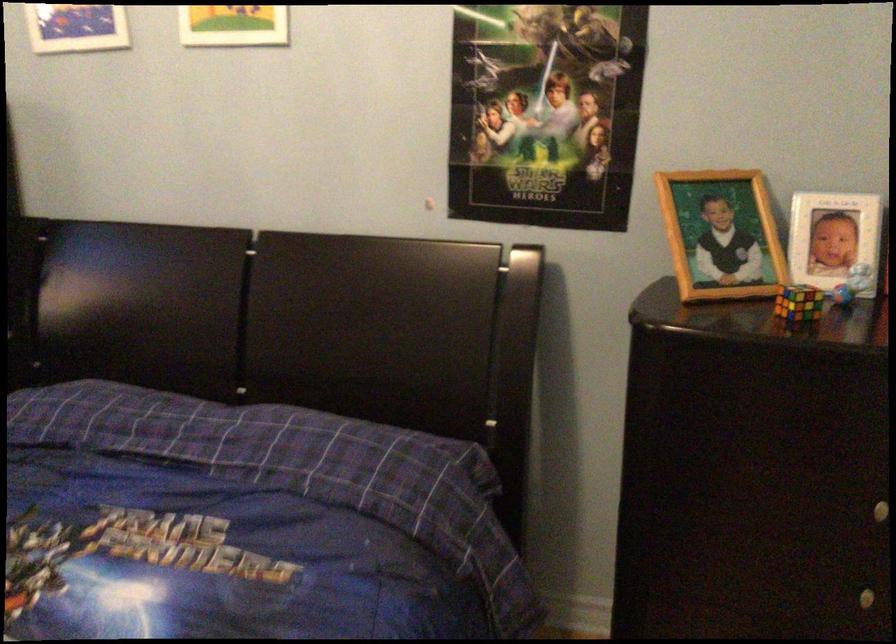
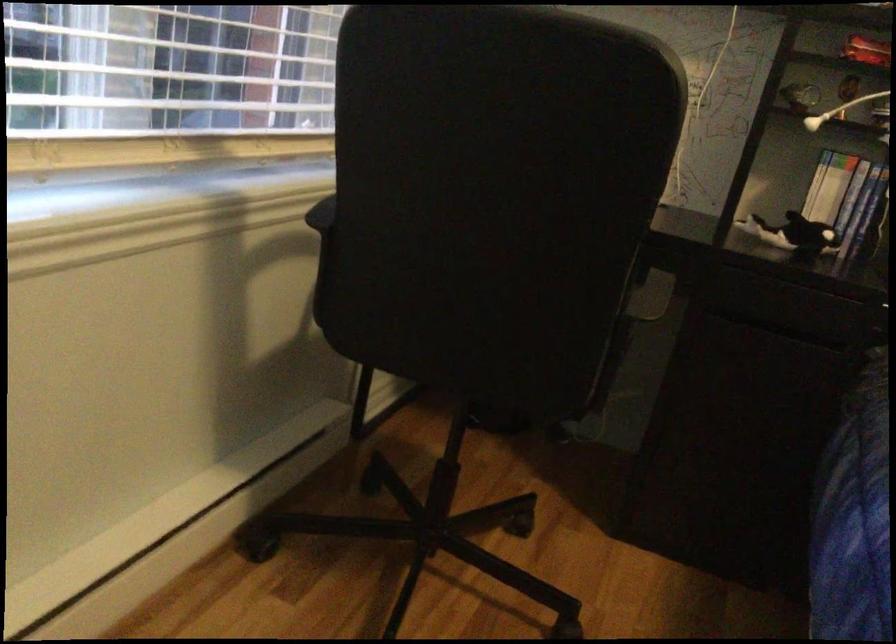
Question: In a continuous first-person perspective shot, in which direction is the camera moving?

Choices:
 (A) Left
 (B) Right
 (C) Forward
 (D) Backward

Answer: (A)